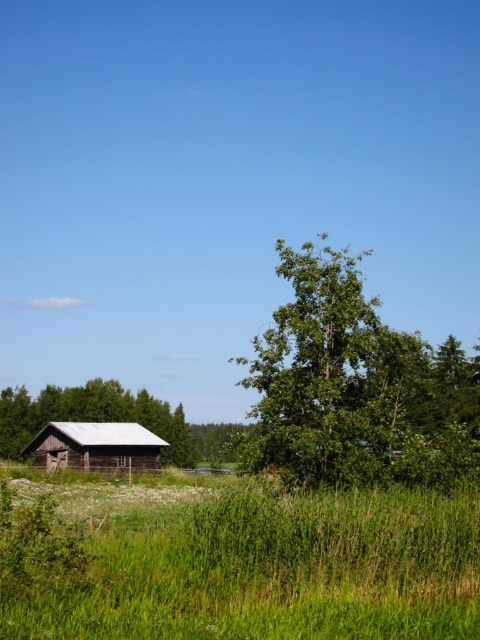
Question: Which object is positioned farthest from the green grassy at lower left?

Choices:
 (A) rustic wooden barn at lower left
 (B) green rough wood house at lower left
 (C) green leafy tree at center

Answer: (B)

Question: Which of the following is the farthest from the observer?

Choices:
 (A) green grassy at lower left
 (B) green rough wood house at lower left
 (C) rustic wooden barn at lower left
 (D) green leafy tree at center

Answer: (B)

Question: Where is green grassy at lower left located in relation to rustic wooden barn at lower left in the image?

Choices:
 (A) above
 (B) below

Answer: (A)

Question: Which point is closer to the camera?

Choices:
 (A) green grassy at lower left
 (B) green leafy tree at center
 (C) green rough wood house at lower left

Answer: (A)

Question: Is green leafy tree at center bigger than green rough wood house at lower left?

Choices:
 (A) no
 (B) yes

Answer: (B)

Question: Is green grassy at lower left smaller than green rough wood house at lower left?

Choices:
 (A) yes
 (B) no

Answer: (B)